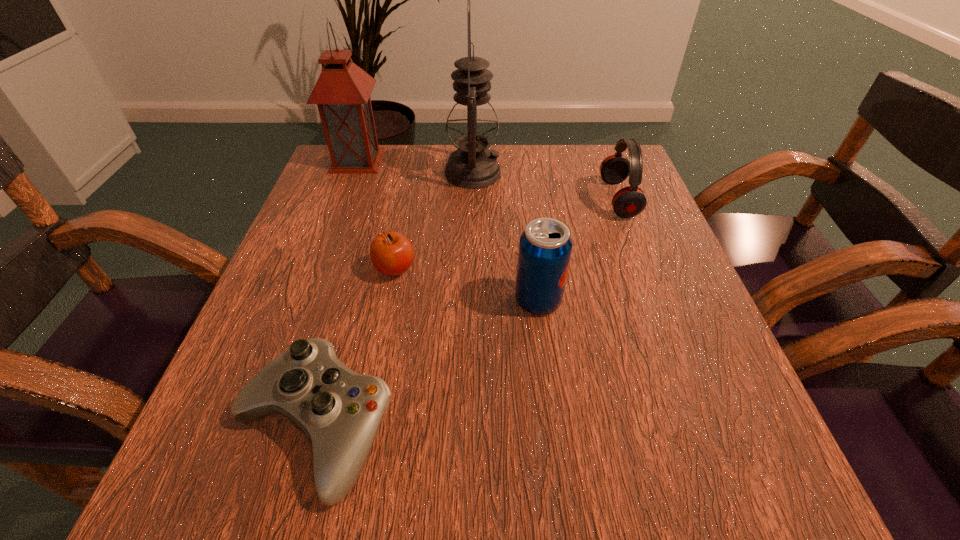
Where is `control that is at the left edge`? The width and height of the screenshot is (960, 540). control that is at the left edge is located at coordinates (339, 411).

Identify the location of object present at the right edge. The width and height of the screenshot is (960, 540). click(628, 202).

Find the location of a particular element. object at the far left corner is located at coordinates (342, 92).

This screenshot has width=960, height=540. What are the coordinates of `object at the near left corner` in the screenshot? It's located at (339, 411).

The width and height of the screenshot is (960, 540). Identify the location of object that is at the far right corner. (628, 202).

Locate an element on the screen. The width and height of the screenshot is (960, 540). vacant area at the far edge of the desktop is located at coordinates (532, 167).

The image size is (960, 540). I want to click on vacant space at the near edge, so click(x=374, y=452).

The width and height of the screenshot is (960, 540). I want to click on vacant region at the left edge of the desktop, so click(x=268, y=308).

The width and height of the screenshot is (960, 540). In the image, there is a desktop. What are the coordinates of `vacant space at the right edge` in the screenshot? It's located at (655, 215).

In the image, there is a desktop. Where is `vacant area at the far right corner`? This screenshot has height=540, width=960. vacant area at the far right corner is located at coordinates (613, 152).